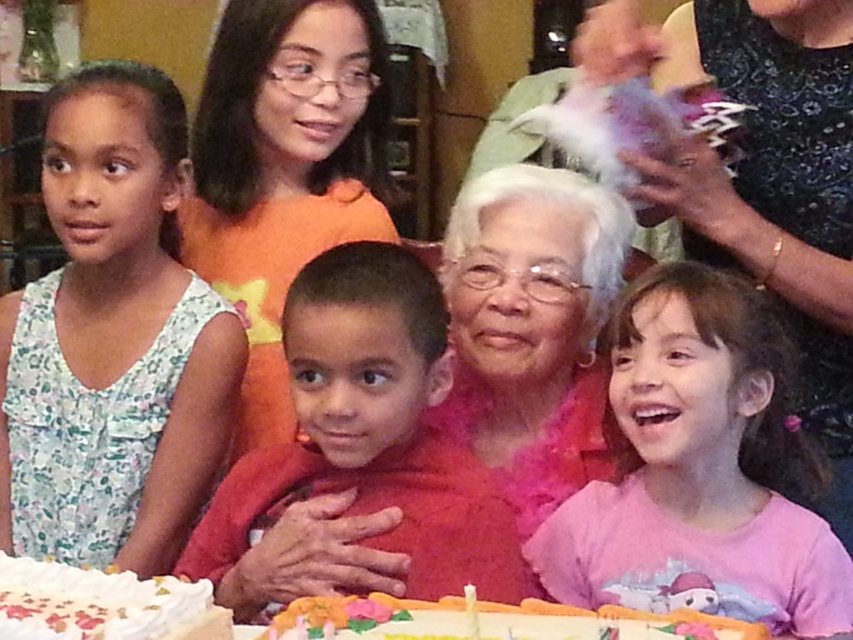
Which is behind, point (152, 122) or point (132, 612)?

The point (152, 122) is behind.

Is point (178, 145) farther from viewer compared to point (19, 611)?

That is True.

Find the location of a particular element. The height and width of the screenshot is (640, 853). floral fabric dress at left is located at coordinates (112, 340).

Is point (163, 109) closer to viewer compared to point (378, 611)?

No, it is behind (378, 611).

Find the location of a particular element. floral fabric dress at left is located at coordinates (112, 340).

I want to click on floral fabric dress at left, so click(x=112, y=340).

Who is more distant from viewer, (x=784, y=480) or (x=445, y=618)?

The point (x=784, y=480) is behind.

Is pink cotton shirt at lower right taller than white frosted cake with colorful decorations at lower center?

Yes.

Which is behind, point (729, 461) or point (373, 605)?

Positioned behind is point (729, 461).

Locate an element on the screen. The height and width of the screenshot is (640, 853). pink cotton shirt at lower right is located at coordinates (700, 468).